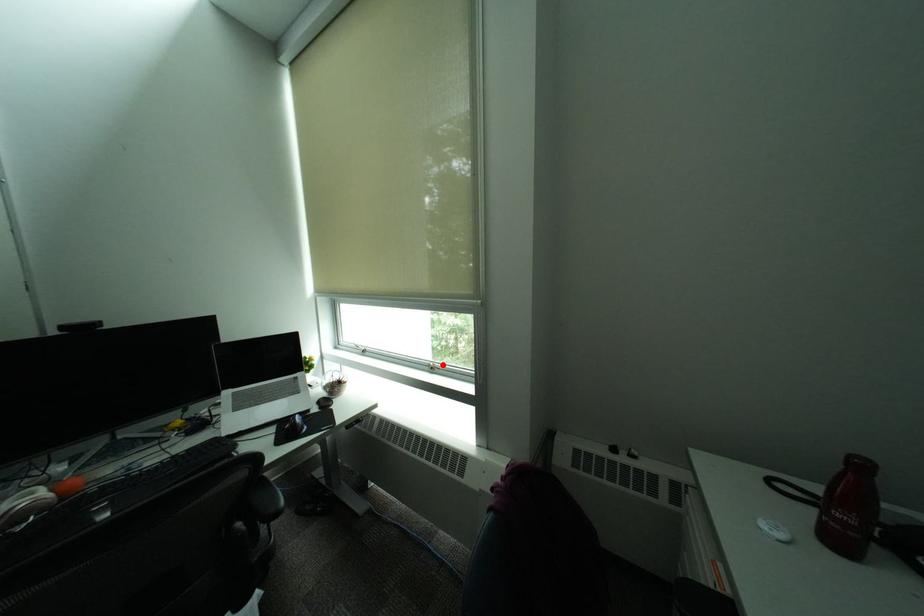
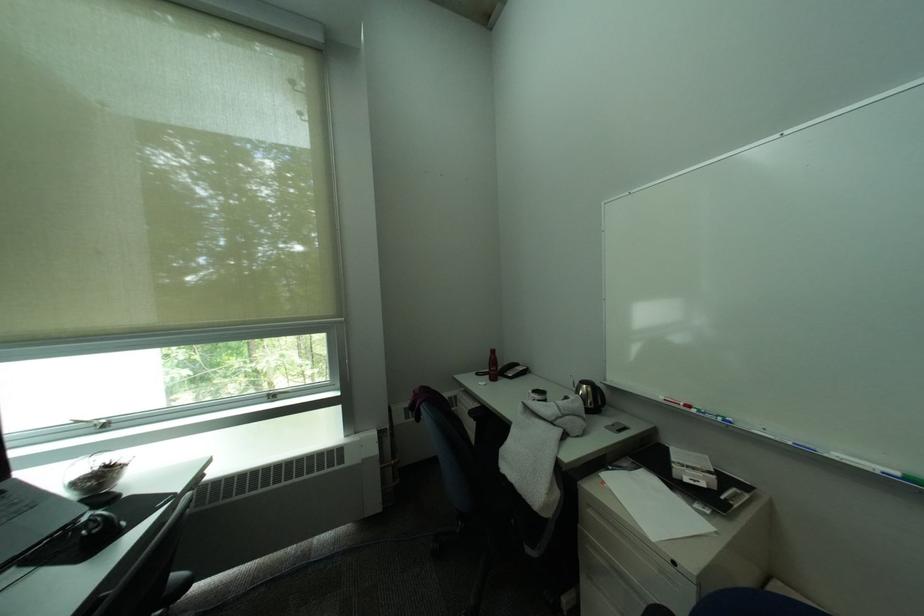
In the second image, find the point that corresponds to the highlighted location in the first image.

(283, 392)